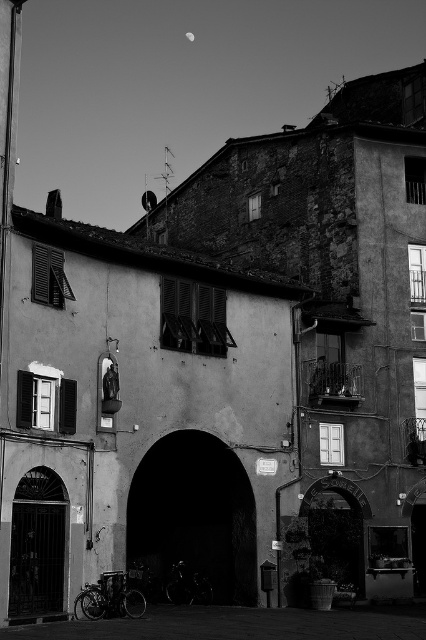
Who is more distant from viewer, [141,538] or [367,616]?

Point [141,538]

Can you confirm if dark stone archway at center is bigger than smooth concrete alley at lower center?

Actually, dark stone archway at center might be smaller than smooth concrete alley at lower center.

Between point (178, 538) and point (328, 628), which one is positioned in front?

Positioned in front is point (328, 628).

Locate an element on the screen. The image size is (426, 640). dark stone archway at center is located at coordinates (195, 515).